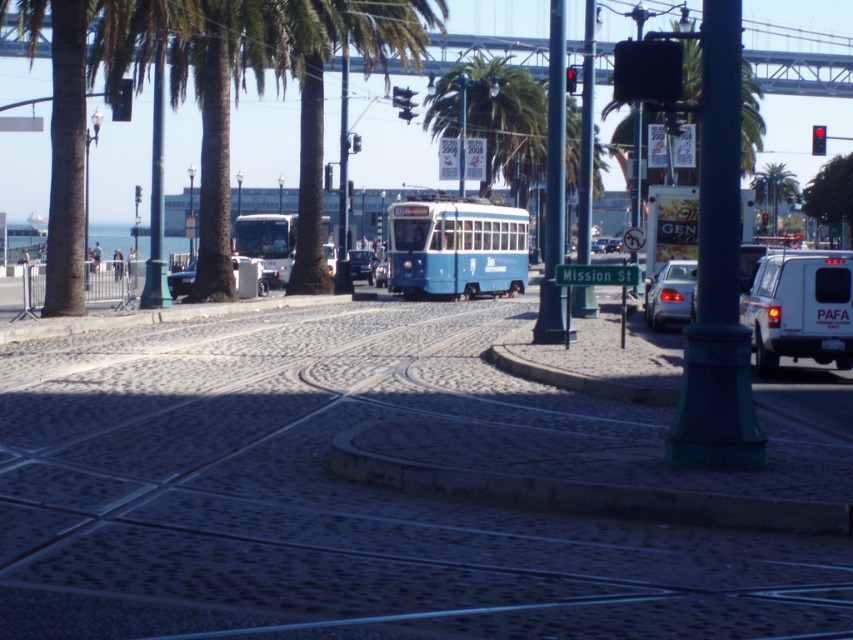
Question: Is the position of white matte van at right less distant than that of green leafy palm tree at center?

Choices:
 (A) yes
 (B) no

Answer: (A)

Question: Can you confirm if green leafy palm tree at center is positioned above metallic silver sedan at center?

Choices:
 (A) yes
 (B) no

Answer: (A)

Question: Which point appears closest to the camera in this image?

Choices:
 (A) (351, 257)
 (B) (815, 148)
 (C) (792, 342)

Answer: (C)

Question: Which object is farther from the camera taking this photo?

Choices:
 (A) shiny silver sedan at center
 (B) metallic silver car at center
 (C) red glass traffic light at upper right
 (D) white matte bus at left

Answer: (C)

Question: Does metallic silver car at center appear on the right side of red glass traffic light at upper right?

Choices:
 (A) yes
 (B) no

Answer: (B)

Question: Which object is positioned closest to the shiny silver sedan at center?

Choices:
 (A) satin silver sedan at center
 (B) metallic silver sedan at center

Answer: (B)